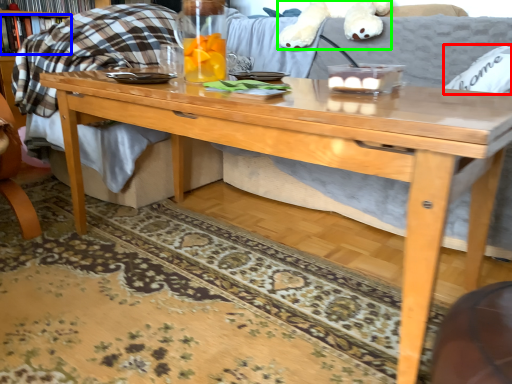
Question: Which is nearer to the pillow (highlighted by a red box)? book (highlighted by a blue box) or animal (highlighted by a green box).

Choices:
 (A) book
 (B) animal

Answer: (B)